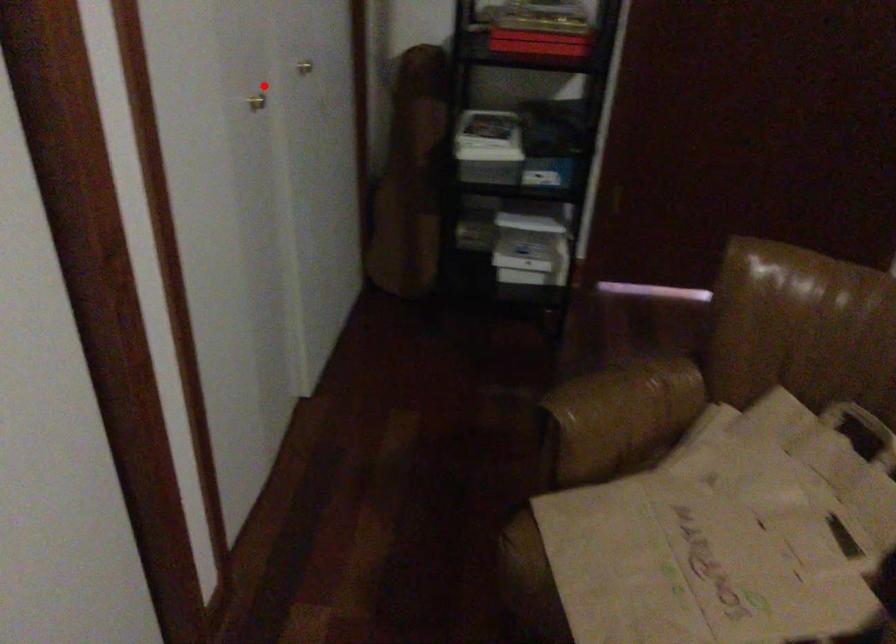
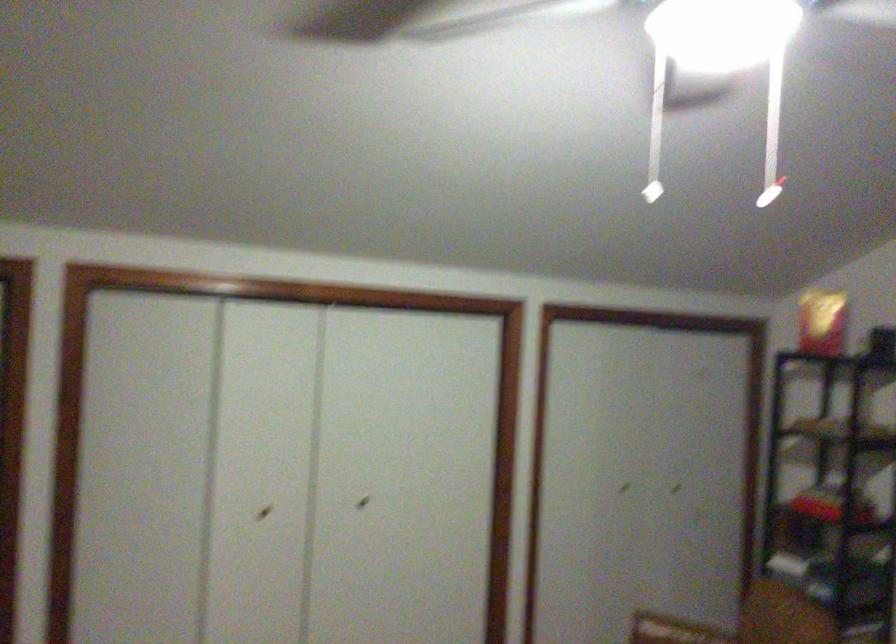
Locate, in the second image, the point that corresponds to the highlighted location in the first image.

(623, 488)